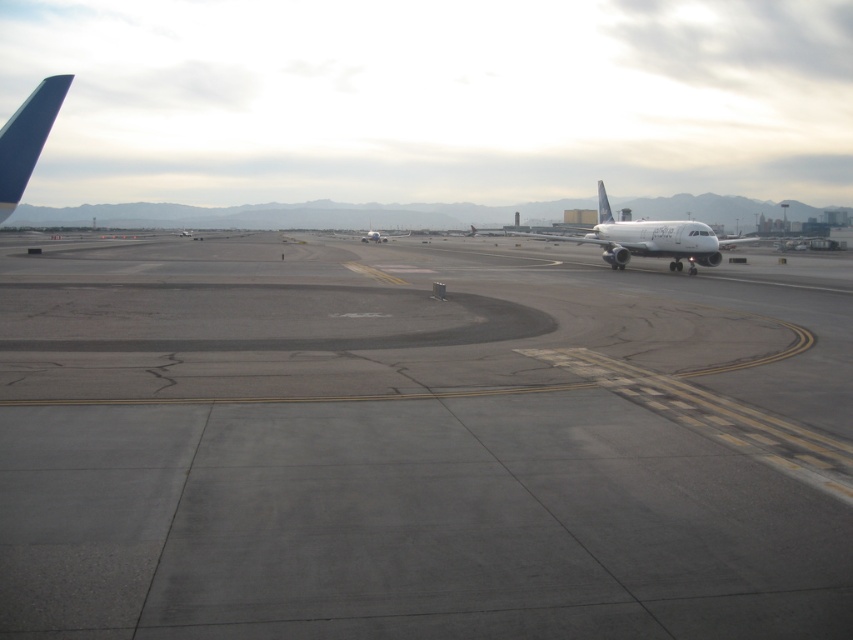
Question: Which object is closer to the camera taking this photo?

Choices:
 (A) white glossy airplane at center
 (B) gray asphalt runway at center

Answer: (B)

Question: Is the position of gray asphalt runway at center less distant than that of white glossy airplane at center?

Choices:
 (A) yes
 (B) no

Answer: (A)

Question: Is gray asphalt runway at center thinner than white glossy airplane at center?

Choices:
 (A) no
 (B) yes

Answer: (A)

Question: Can you confirm if gray asphalt runway at center is positioned to the right of white glossy airplane at center?

Choices:
 (A) no
 (B) yes

Answer: (A)